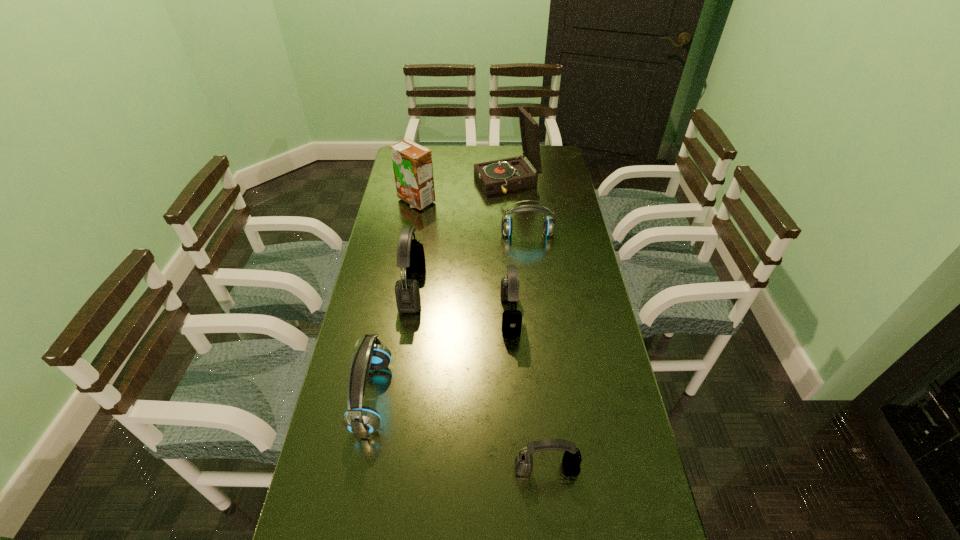
Find the location of `object that is at the far edge`. object that is at the far edge is located at coordinates (499, 176).

Where is `carton that is at the left edge`? Image resolution: width=960 pixels, height=540 pixels. carton that is at the left edge is located at coordinates (412, 163).

Locate an element on the screen. This screenshot has height=540, width=960. phonograph record located at the right edge is located at coordinates (499, 176).

You are a GUI agent. You are given a task and a screenshot of the screen. Output one action in this format:
    pyautogui.click(x=<x>, y=<y>)
    Task: Click on the object that is at the far right corner
    
    Given the screenshot: What is the action you would take?
    pyautogui.click(x=499, y=176)

You are a GUI agent. You are given a task and a screenshot of the screen. Output one action in this format:
    pyautogui.click(x=<x>, y=<y>)
    Task: Click on the vacant space at the far edge of the desktop
    The height and width of the screenshot is (540, 960).
    Given the screenshot: What is the action you would take?
    pos(462,152)

This screenshot has height=540, width=960. Identify the location of vacant space at the left edge of the desktop. (348, 447).

In the image, there is a desktop. Where is `vacant space at the right edge`? This screenshot has width=960, height=540. vacant space at the right edge is located at coordinates (564, 238).

Where is `free space between the carton and the fifth nearest object`? The image size is (960, 540). free space between the carton and the fifth nearest object is located at coordinates (471, 217).

At what (x,y) coordinates should I click in order to perform the action: click on vacant area between the nearest headset and the tallest object. Please return your answer as a coordinate pair (x, y). Image resolution: width=960 pixels, height=540 pixels. Looking at the image, I should click on (527, 326).

Where is `unoccupied position between the smallest black headset and the carton`? unoccupied position between the smallest black headset and the carton is located at coordinates (481, 335).